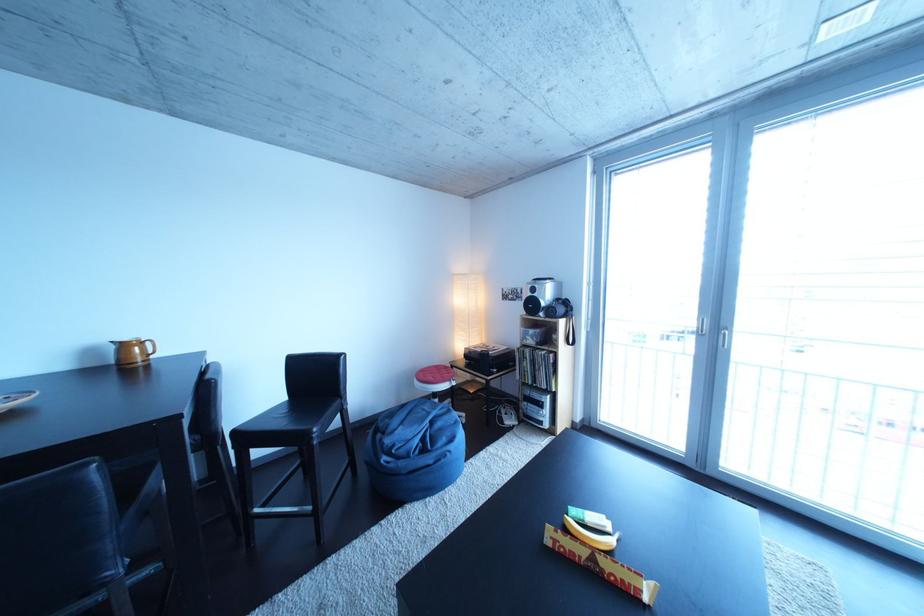
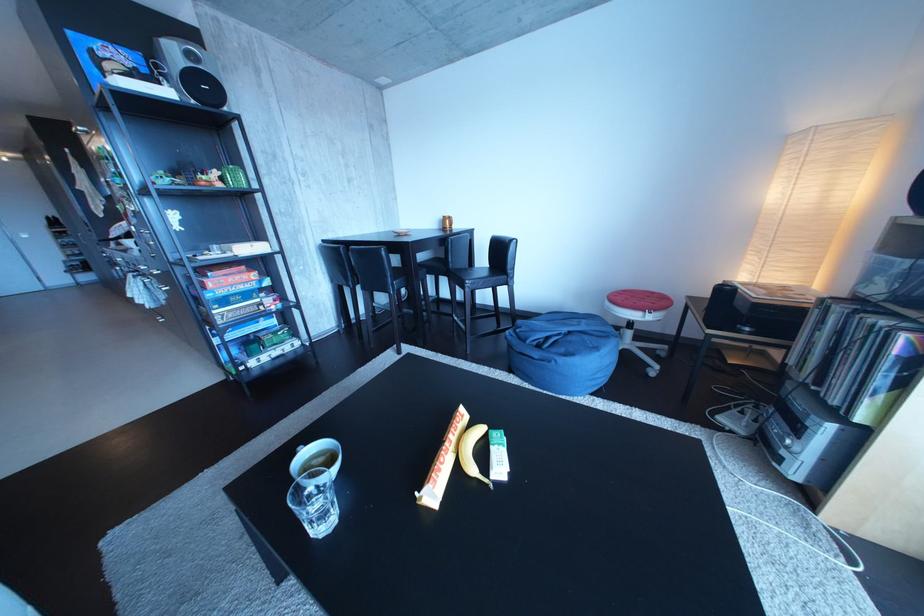
The point at (329, 436) is marked in the first image. Where is the corresponding point in the second image?

(480, 286)